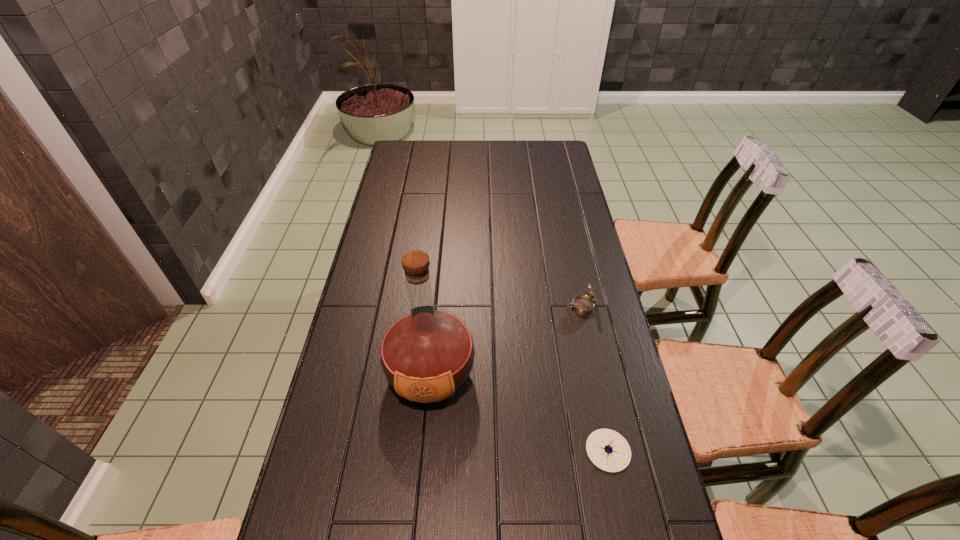
The width and height of the screenshot is (960, 540). Identify the location of vacant space that satisfies the following two spatial constraints: 1. with the dial facing the farther compass; 2. on the front label of the liquor. (596, 374).

Locate an element on the screen. This screenshot has height=540, width=960. vacant space that satisfies the following two spatial constraints: 1. with the dial facing the farther compass; 2. on the front label of the tallest object is located at coordinates (596, 374).

I want to click on vacant space that satisfies the following two spatial constraints: 1. with the dial facing the farthest object; 2. on the front label of the liquor, so click(x=596, y=374).

Identify the location of vacant point that satisfies the following two spatial constraints: 1. with the dial facing the second shortest object; 2. on the front label of the liquor. The height and width of the screenshot is (540, 960). (596, 374).